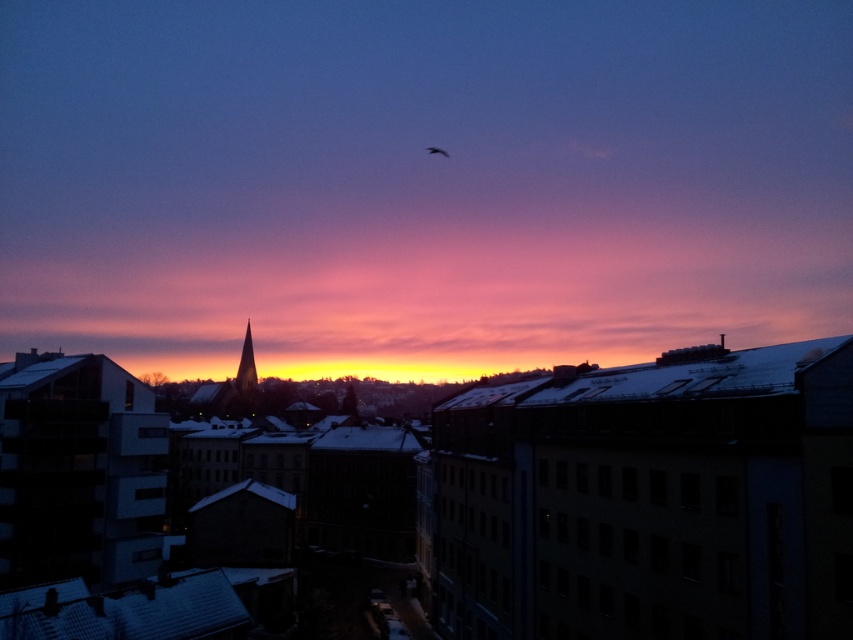
You are standing at point [247,368] in the image and want to look at the golden glass spire at center. Which direction should you turn to face it?

The golden glass spire at center is located at your current position, so you are already facing it.

You are an architect designing a new city skyline. You want to ensure that the golden glass spire at center and the silvery metallic bird at upper center are visible from a viewpoint across the river. Based on their positions in the image, which object will appear closer to the viewer when looking from that vantage point?

The golden glass spire at center is in front of the silvery metallic bird at upper center, so it will appear closer to the viewer when looking from the river viewpoint.